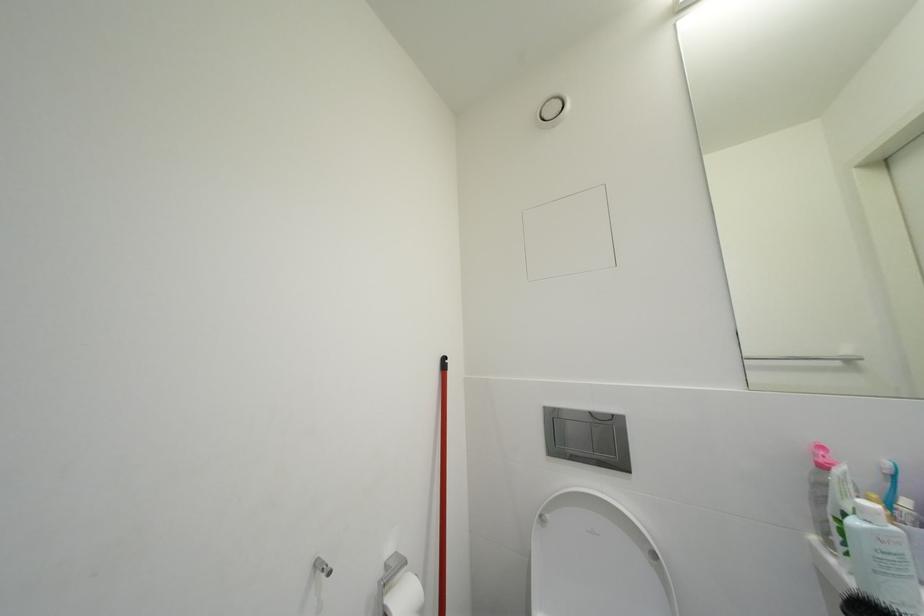
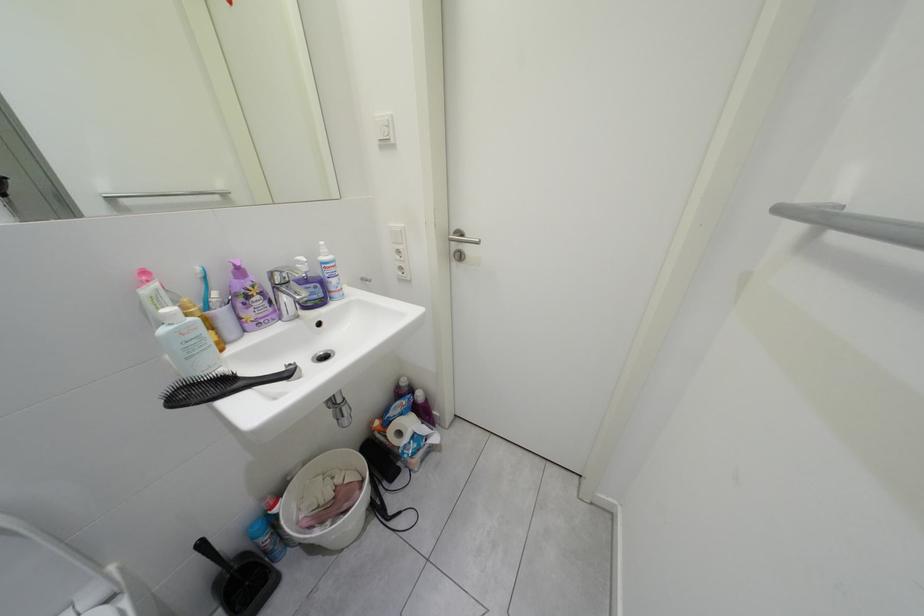
First-person continuous shooting, in which direction is the camera rotating?

The camera rotated toward right-down.